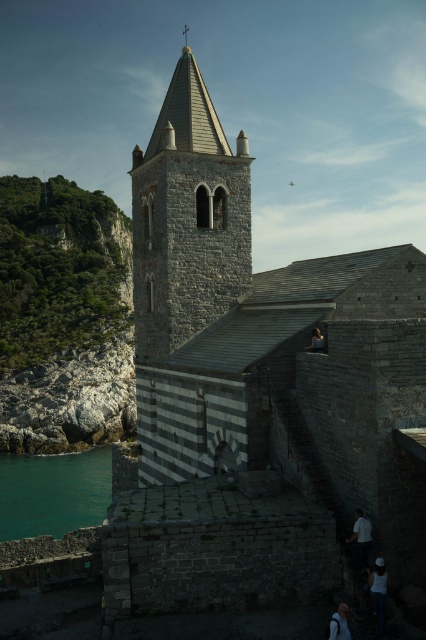
Question: Does gray stone church at center have a larger size compared to teal stone water at lower left?

Choices:
 (A) yes
 (B) no

Answer: (A)

Question: Is gray stone tower at center thinner than white fabric shirt at lower right?

Choices:
 (A) no
 (B) yes

Answer: (A)

Question: Considering the real-world distances, which object is farthest from the white fabric shirt at lower right?

Choices:
 (A) smooth gray hair at center
 (B) gray stone tower at center

Answer: (B)

Question: Is gray stone church at center wider than teal stone water at lower left?

Choices:
 (A) no
 (B) yes

Answer: (B)

Question: Which object appears farthest from the camera in this image?

Choices:
 (A) teal stone water at lower left
 (B) smooth gray hair at center
 (C) white fabric shirt at lower right
 (D) white fabric shirt at lower center

Answer: (A)

Question: Which of the following is the farthest from the observer?

Choices:
 (A) white cotton shirt at lower right
 (B) white fabric shirt at lower right
 (C) smooth gray hair at center

Answer: (B)